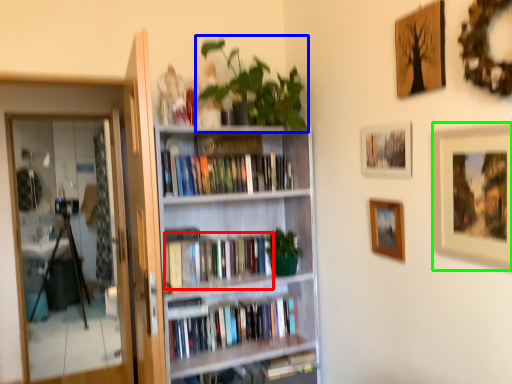
Question: Which object is the farthest from book (highlighted by a red box)? Choose among these: plant (highlighted by a blue box) or picture frame (highlighted by a green box).

Choices:
 (A) plant
 (B) picture frame

Answer: (B)